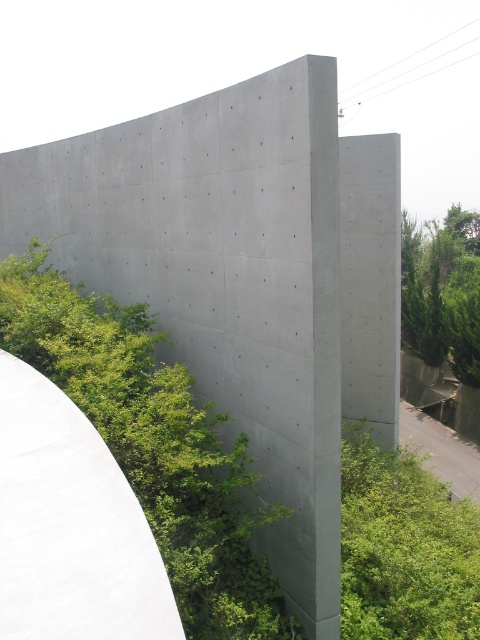
Question: In this image, where is green leafy bush at lower right located relative to green leafy tree at right?

Choices:
 (A) below
 (B) above

Answer: (A)

Question: Which object is farther from the camera taking this photo?

Choices:
 (A) green leafy tree at right
 (B) green leafy bush at lower right
 (C) green leafy shrub at center-left

Answer: (A)

Question: Does green leafy shrub at center-left appear on the right side of green leafy tree at right?

Choices:
 (A) no
 (B) yes

Answer: (A)

Question: Estimate the real-world distances between objects in this image. Which object is closer to the green leafy tree at right?

Choices:
 (A) gray concrete wall at center
 (B) green leafy bush at lower right

Answer: (B)

Question: Which object appears farthest from the camera in this image?

Choices:
 (A) gray concrete wall at center
 (B) green leafy bush at lower right
 (C) green leafy tree at right
 (D) green leafy shrub at center-left

Answer: (C)

Question: Does green leafy shrub at center-left appear over gray concrete wall at center?

Choices:
 (A) yes
 (B) no

Answer: (A)